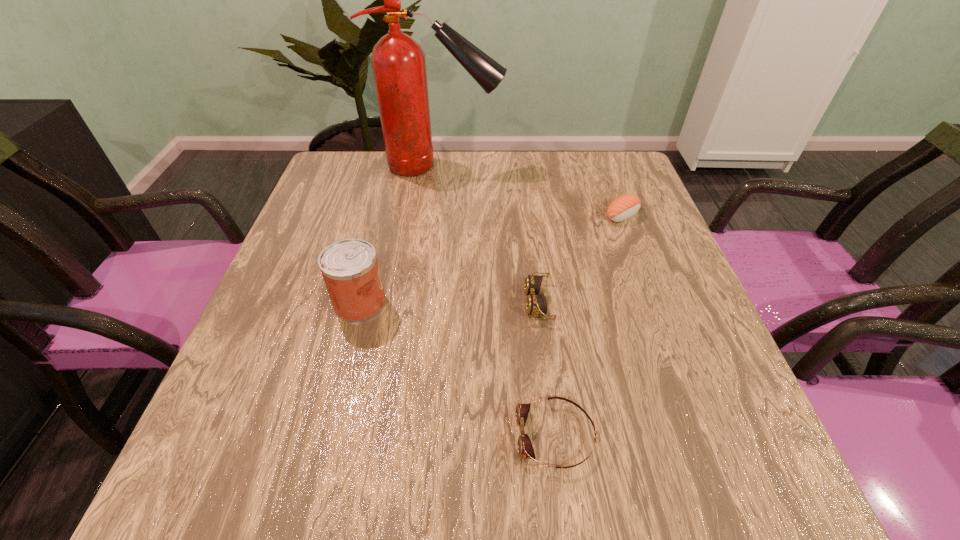
Where is `the farthest object`? This screenshot has width=960, height=540. the farthest object is located at coordinates (398, 62).

This screenshot has width=960, height=540. I want to click on fire extinguisher, so click(x=398, y=62).

Locate an element on the screen. The width and height of the screenshot is (960, 540). can is located at coordinates (349, 267).

In order to click on the fourth nearest object in this screenshot , I will do `click(625, 206)`.

Image resolution: width=960 pixels, height=540 pixels. Identify the location of the rightmost object. (625, 206).

Locate an element on the screen. Image resolution: width=960 pixels, height=540 pixels. the farther goggles is located at coordinates (536, 304).

This screenshot has width=960, height=540. I want to click on the fourth tallest object, so click(x=536, y=304).

Where is `the shorter goggles`? This screenshot has width=960, height=540. the shorter goggles is located at coordinates (525, 449).

I want to click on the nearest object, so click(525, 449).

Locate an element on the screen. free spot located at the nozzle end of the farthest object is located at coordinates (569, 166).